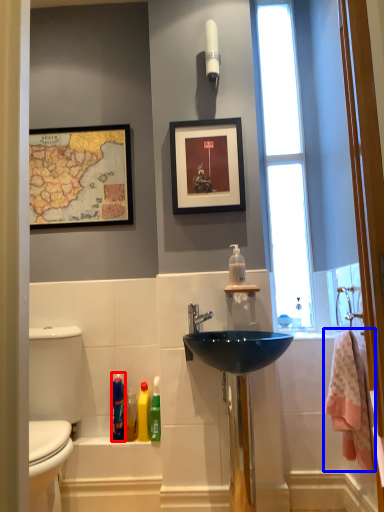
Question: Among these objects, which one is nearest to the camera, cleaning product (highlighted by a red box) or bath towel (highlighted by a blue box)?

Choices:
 (A) cleaning product
 (B) bath towel

Answer: (B)